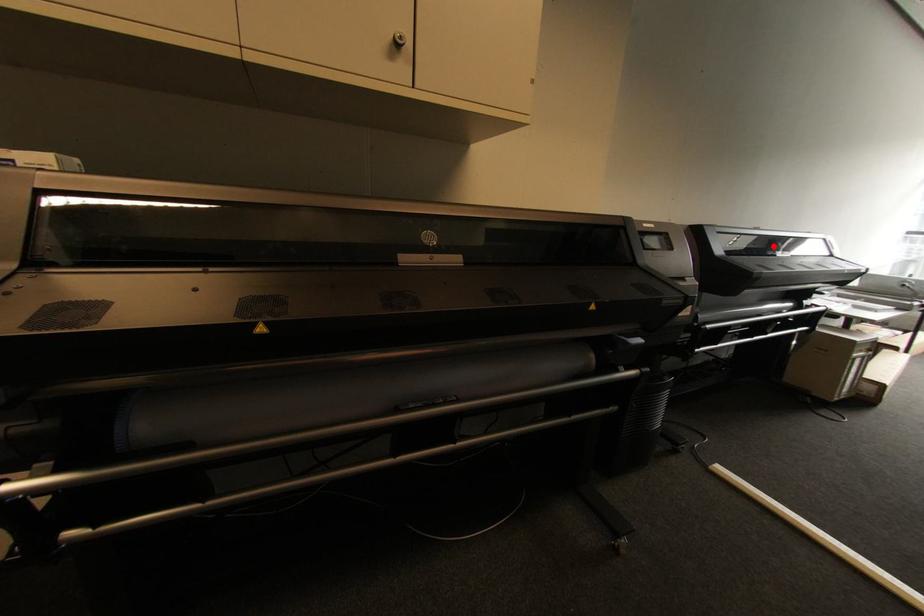
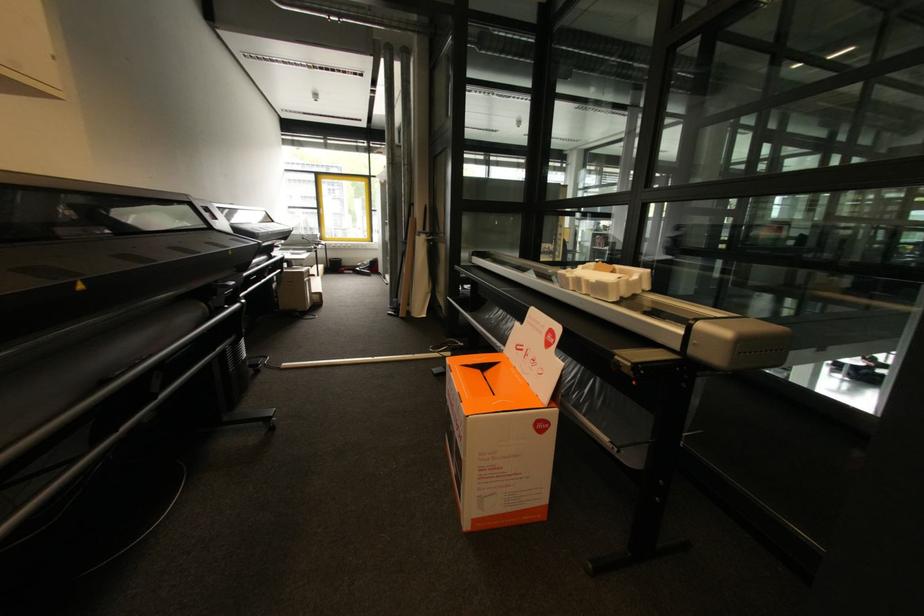
Locate, in the second image, the point that corresponds to the highlighted location in the first image.

(245, 217)